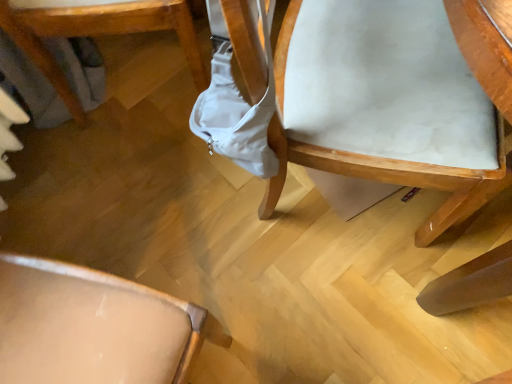
Question: In the image, is white fabric chair at upper right, the 1th chair in the right-to-left sequence, positioned in front of or behind light brown wood chair at lower left, which is the 2th chair from right to left?

Choices:
 (A) front
 (B) behind

Answer: (A)

Question: From the image's perspective, is white fabric chair at upper right, the 1th chair in the right-to-left sequence, located above or below light brown wood chair at lower left, which is the first chair in left-to-right order?

Choices:
 (A) above
 (B) below

Answer: (B)

Question: Is white fabric chair at upper right, the 2th chair from the left, taller or shorter than light brown wood chair at lower left, which is the first chair in left-to-right order?

Choices:
 (A) tall
 (B) short

Answer: (A)

Question: From a real-world perspective, is light brown wood chair at lower left, which is the first chair in left-to-right order, positioned above or below white fabric chair at upper right, the 1th chair in the right-to-left sequence?

Choices:
 (A) below
 (B) above

Answer: (A)

Question: From the image's perspective, relative to white fabric chair at upper right, the 2th chair from the left, is light brown wood chair at lower left, which is the 2th chair from right to left, above or below?

Choices:
 (A) below
 (B) above

Answer: (B)

Question: Does point (159, 1) appear closer or farther from the camera than point (282, 44)?

Choices:
 (A) farther
 (B) closer

Answer: (A)

Question: Is light brown wood chair at lower left, which is the 2th chair from right to left, inside or outside of white fabric chair at upper right, the 1th chair in the right-to-left sequence?

Choices:
 (A) outside
 (B) inside

Answer: (A)